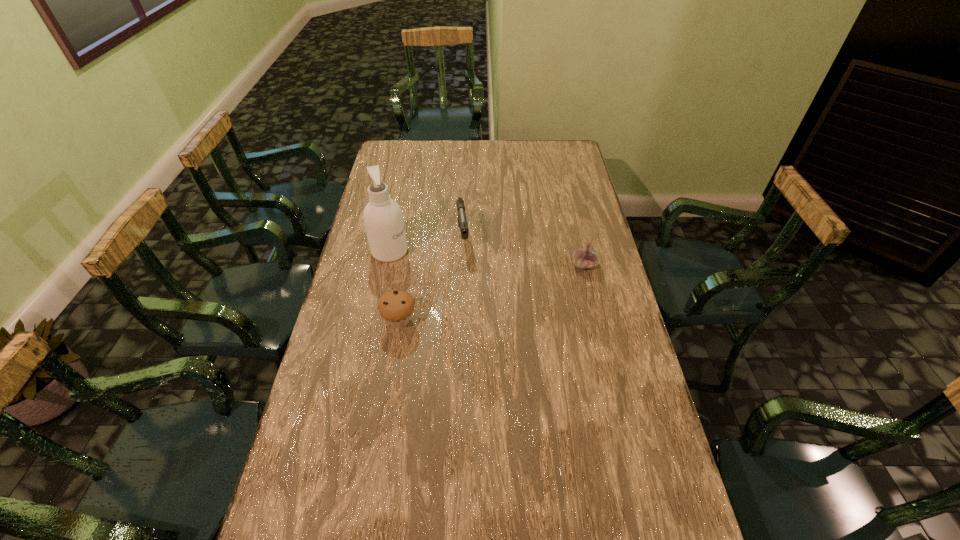
This screenshot has height=540, width=960. In order to click on vacant area situated on the front label of the tallest object in this screenshot , I will do `click(466, 271)`.

The height and width of the screenshot is (540, 960). In order to click on vacant point located 0.140m on the front label of the tallest object in this screenshot , I will do (x=442, y=265).

Image resolution: width=960 pixels, height=540 pixels. I want to click on muffin at the left edge, so click(x=396, y=307).

Locate an element on the screen. This screenshot has width=960, height=540. cleansing agent located at the left edge is located at coordinates (383, 219).

I want to click on object present at the right edge, so click(586, 257).

Where is `vacant space at the far edge of the desktop`? Image resolution: width=960 pixels, height=540 pixels. vacant space at the far edge of the desktop is located at coordinates (492, 147).

Where is `vacant space at the left edge`? Image resolution: width=960 pixels, height=540 pixels. vacant space at the left edge is located at coordinates (372, 309).

Identify the location of vacant area at the right edge. (595, 240).

Where is `free space at the near left corner`? This screenshot has height=540, width=960. free space at the near left corner is located at coordinates (340, 514).

Image resolution: width=960 pixels, height=540 pixels. What are the coordinates of `vacant space at the far right corner of the desktop` in the screenshot? It's located at (575, 151).